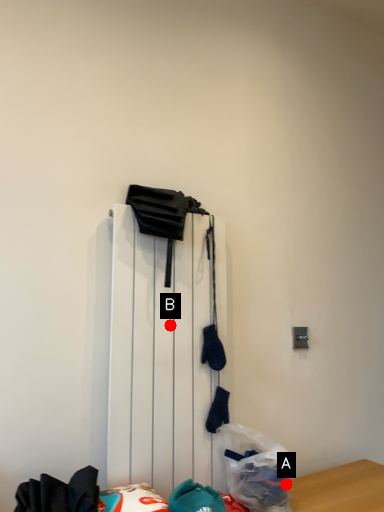
Question: Two points are circled on the image, labeled by A and B beside each circle. Among these points, which one is nearest to the camera?

Choices:
 (A) A is closer
 (B) B is closer

Answer: (B)